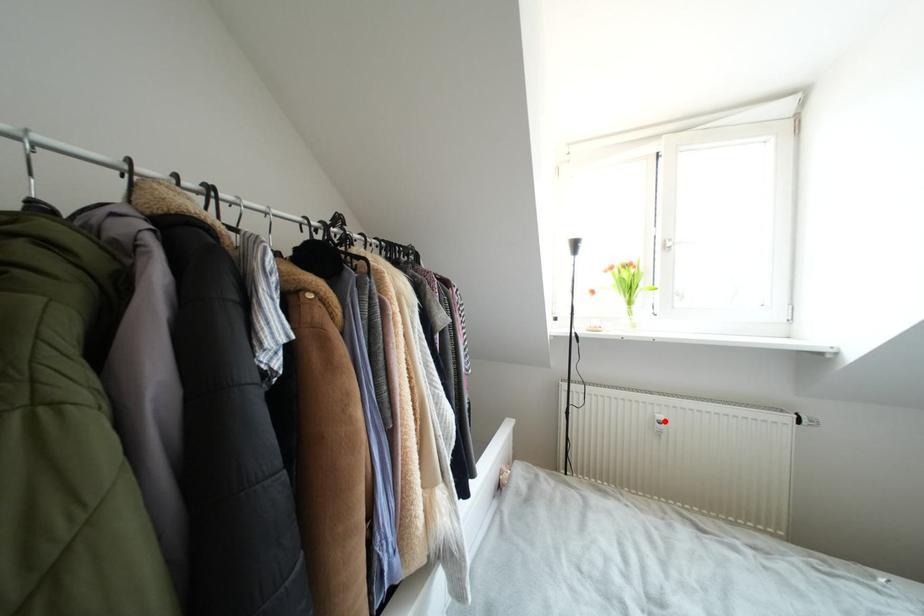
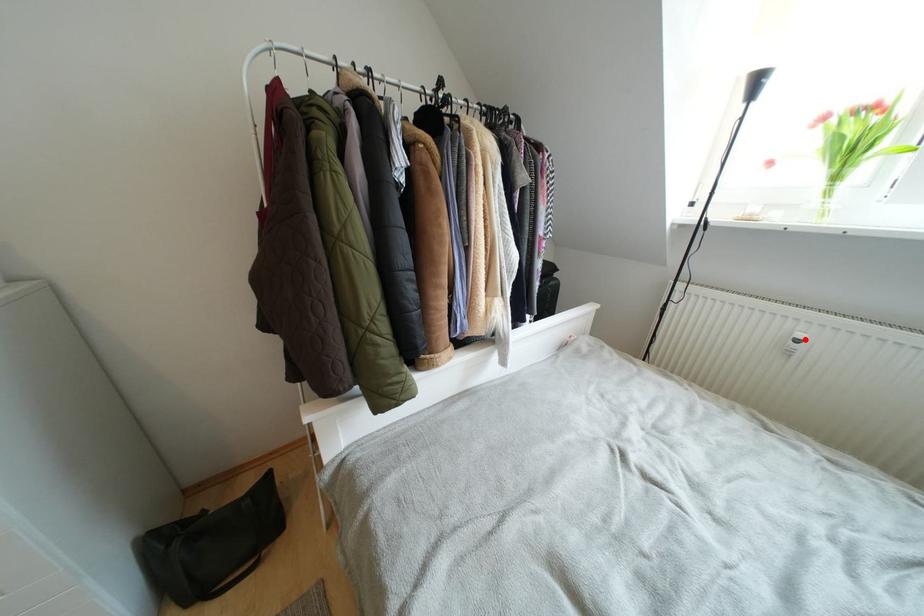
I am providing you with two images of the same scene from different viewpoints. A red point is marked on the first image and another point is marked on the second image. Is the marked point in image1 the same physical position as the marked point in image2?

Yes